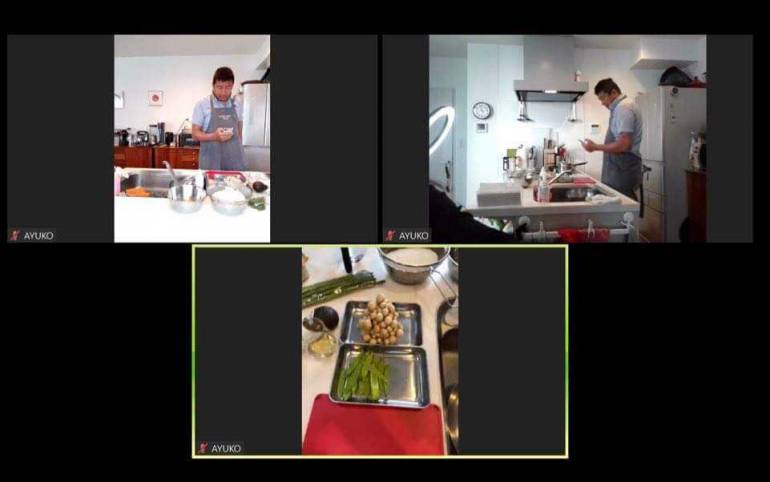
At what (x,y) coordinates should I click in order to perform the action: click on clock. Please return your answer as a coordinate pair (x, y). The width and height of the screenshot is (770, 482). Looking at the image, I should click on (480, 112).